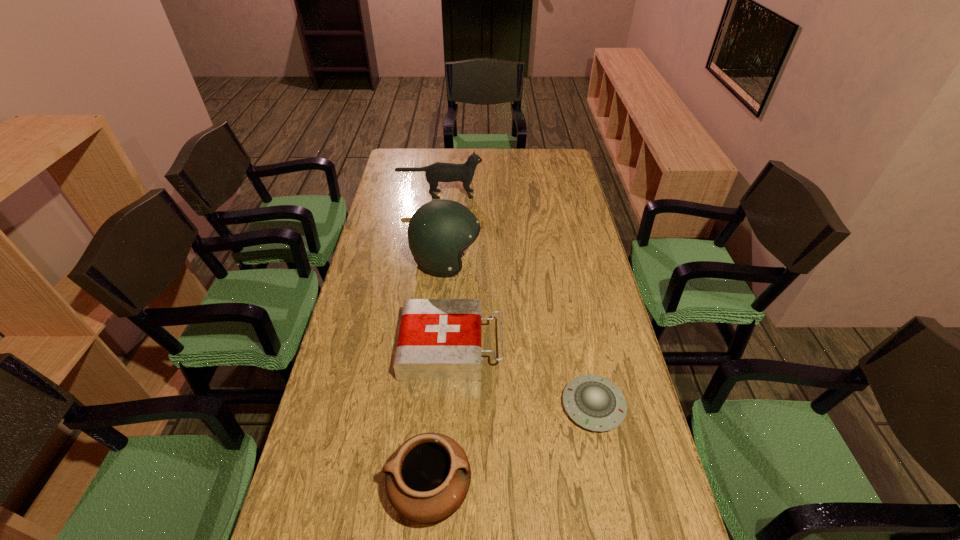
Find the location of a particular element. the tallest object is located at coordinates (439, 231).

Image resolution: width=960 pixels, height=540 pixels. I want to click on the fourth nearest object, so click(x=439, y=231).

Locate an element on the screen. The image size is (960, 540). cat is located at coordinates (438, 172).

What are the coordinates of `the fourth shortest object` in the screenshot? It's located at (438, 172).

The height and width of the screenshot is (540, 960). Find the location of `the nearest object`. the nearest object is located at coordinates click(x=427, y=479).

Where is `the third shortest object`? the third shortest object is located at coordinates (427, 479).

In order to click on the first-aid kit in this screenshot , I will do `click(439, 339)`.

This screenshot has height=540, width=960. In order to click on the rightmost object in this screenshot , I will do `click(595, 403)`.

Locate an element on the screen. saucer is located at coordinates (595, 403).

This screenshot has width=960, height=540. What are the coordinates of `free point located 0.340m at the face opening of the tallest object` in the screenshot? It's located at (575, 261).